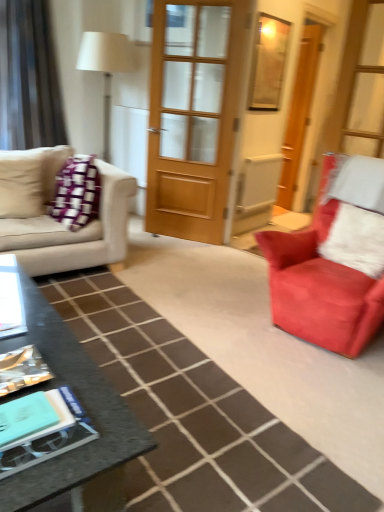
You are a GUI agent. You are given a task and a screenshot of the screen. Output one action in this format:
    pyautogui.click(x=<x>, y=<y>)
    Task: Click on the free location in front of suede red armchair at right
    
    Given the screenshot: What is the action you would take?
    pyautogui.click(x=313, y=411)